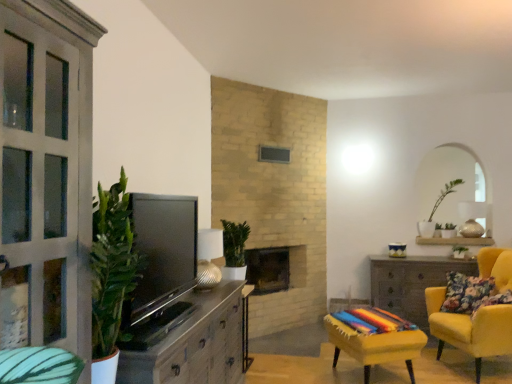
The height and width of the screenshot is (384, 512). Describe the element at coordinates (375, 338) in the screenshot. I see `yellow fabric-covered chair at lower right, which is the 1th chair from left to right` at that location.

The width and height of the screenshot is (512, 384). Find the location of `wooden desk at right`. wooden desk at right is located at coordinates (411, 283).

This screenshot has width=512, height=384. I want to click on green matte plant at upper right, which is the 2th houseplant in left-to-right order, so click(x=436, y=210).

In order to face yellow fabric chair at right, positioned as the 1th chair in right-to-left order, should I rotate leftwards or rightwards?

You should rotate right by 29.006 degrees.

Image resolution: width=512 pixels, height=384 pixels. In order to click on wooden cabinet at left in this screenshot , I will do `click(193, 344)`.

Identify the location of matte black tv at left. Image resolution: width=512 pixels, height=384 pixels. (161, 266).

Considering the relative sizes of floral fabric pillow at right and yellow fabric-covered chair at lower right, acting as the 2th chair starting from the right, in the image provided, is floral fabric pillow at right shorter than yellow fabric-covered chair at lower right, acting as the 2th chair starting from the right,?

Yes, floral fabric pillow at right is shorter than yellow fabric-covered chair at lower right, acting as the 2th chair starting from the right.

You are a GUI agent. You are given a task and a screenshot of the screen. Output one action in this format:
    pyautogui.click(x=<x>, y=<y>)
    Task: Click on the chair that is the 2nd object directly below the floral fabric pillow at right (from a real-world perspective)
    
    Given the screenshot: What is the action you would take?
    pyautogui.click(x=375, y=338)

Can you tell me how much floral fabric pillow at right and yellow fabric-covered chair at lower right, which is the 1th chair from left to right, differ in facing direction?

42.9 degrees.

Is green leafy plant at center-right spatially inside matte black tv at left, or outside of it?

green leafy plant at center-right exists outside the volume of matte black tv at left.

Is green leafy plant at center-right in contact with matte black tv at left?

green leafy plant at center-right is not next to matte black tv at left, and they're not touching.

From the image's perspective, which one is positioned higher, green leafy plant at center-right or matte black tv at left?

matte black tv at left, from the image's perspective.

Can you confirm if yellow fabric-covered chair at lower right, acting as the 2th chair starting from the right, is shorter than metallic ribbed lampshade at center?

Correct, yellow fabric-covered chair at lower right, acting as the 2th chair starting from the right, is not as tall as metallic ribbed lampshade at center.

Which object is positioned more to the right, yellow fabric-covered chair at lower right, acting as the 2th chair starting from the right, or metallic ribbed lampshade at center?

Positioned to the right is yellow fabric-covered chair at lower right, acting as the 2th chair starting from the right.

From a real-world perspective, between yellow fabric-covered chair at lower right, which is the 1th chair from left to right, and metallic ribbed lampshade at center, who is vertically higher?

metallic ribbed lampshade at center is physically above.

Between yellow fabric-covered chair at lower right, which is the 1th chair from left to right, and metallic ribbed lampshade at center, which one has smaller width?

metallic ribbed lampshade at center is thinner.

From a real-world perspective, is green matte plant at center, the first houseplant from the left, positioned over metallic ribbed lampshade at center based on gravity?

No, from a real-world perspective, green matte plant at center, the first houseplant from the left, is not over metallic ribbed lampshade at center

In the image, is green matte plant at center, arranged as the 1th houseplant when viewed from the front, positioned in front of or behind metallic ribbed lampshade at center?

Clearly, green matte plant at center, arranged as the 1th houseplant when viewed from the front, is behind metallic ribbed lampshade at center.

Locate an element on the screen. The width and height of the screenshot is (512, 384). houseplant below the metallic ribbed lampshade at center (from a real-world perspective) is located at coordinates (234, 249).

Can you confirm if green matte plant at center, the first houseplant from the left, is thinner than metallic ribbed lampshade at center?

→ No.

Which object is positioned more to the left, matte black tv at left or metallic ribbed lampshade at center?

matte black tv at left is more to the left.

From the image's perspective, is matte black tv at left above metallic ribbed lampshade at center?

Yes, from the image's perspective, matte black tv at left is above metallic ribbed lampshade at center.

Is matte black tv at left not near metallic ribbed lampshade at center?

matte black tv at left is near metallic ribbed lampshade at center, not far away.

From a real-world perspective, who is located lower, matte black tv at left or metallic ribbed lampshade at center?

metallic ribbed lampshade at center.

Image resolution: width=512 pixels, height=384 pixels. I want to click on pillow on the right of the brick fireplace at center, so click(x=466, y=293).

Looking at their sizes, would you say brick fireplace at center is wider or thinner than floral fabric pillow at right?

In the image, brick fireplace at center appears to be wider than floral fabric pillow at right.

From the image's perspective, is brick fireplace at center above or below floral fabric pillow at right?

Based on their image positions, brick fireplace at center is located above floral fabric pillow at right.

Is brick fireplace at center in front of or behind floral fabric pillow at right in the image?

Visually, brick fireplace at center is located behind floral fabric pillow at right.

Looking at this image, which object is further away from the camera taking this photo, yellow fabric-covered chair at lower right, which is the 1th chair from left to right, or wooden desk at right?

wooden desk at right is further away from the camera.

Considering the positions of objects yellow fabric-covered chair at lower right, which is the 1th chair from left to right, and wooden desk at right in the image provided, who is more to the right, yellow fabric-covered chair at lower right, which is the 1th chair from left to right, or wooden desk at right?

wooden desk at right.

In terms of width, does yellow fabric-covered chair at lower right, acting as the 2th chair starting from the right, look wider or thinner when compared to wooden desk at right?

Clearly, yellow fabric-covered chair at lower right, acting as the 2th chair starting from the right, has more width compared to wooden desk at right.

Based on the photo, is yellow fabric-covered chair at lower right, which is the 1th chair from left to right, bigger than wooden desk at right?

Incorrect, yellow fabric-covered chair at lower right, which is the 1th chair from left to right, is not larger than wooden desk at right.

At what (x,y) coordinates should I click in order to perform the action: click on pillow behind the yellow fabric-covered chair at lower right, which is the 1th chair from left to right. Please return your answer as a coordinate pair (x, y). The image size is (512, 384). Looking at the image, I should click on (466, 293).

Where is `television lying on the left of green leafy plant at center-right`? Image resolution: width=512 pixels, height=384 pixels. television lying on the left of green leafy plant at center-right is located at coordinates (161, 266).

Estimate the real-world distances between objects in this image. Which object is further from yellow fabric-covered chair at lower right, acting as the 2th chair starting from the right, brick fireplace at center or matte black tv at left?

Among the two, matte black tv at left is located further to yellow fabric-covered chair at lower right, acting as the 2th chair starting from the right.

Which object lies nearer to the anchor point yellow fabric-covered chair at lower right, acting as the 2th chair starting from the right, brick fireplace at center or floral fabric pillow at right?

Among the two, floral fabric pillow at right is located nearer to yellow fabric-covered chair at lower right, acting as the 2th chair starting from the right.

Considering their positions, is metallic ribbed lampshade at center positioned closer to green matte plant at upper right, the 1th houseplant in the back-to-front sequence, than yellow fabric chair at right, positioned as the 1th chair in right-to-left order?

yellow fabric chair at right, positioned as the 1th chair in right-to-left order, is closer to green matte plant at upper right, the 1th houseplant in the back-to-front sequence.

Which object lies further to the anchor point wooden cabinet at left, yellow fabric-covered chair at lower right, which is the 1th chair from left to right, or metallic ribbed lampshade at center?

Based on the image, yellow fabric-covered chair at lower right, which is the 1th chair from left to right, appears to be further to wooden cabinet at left.

Estimate the real-world distances between objects in this image. Which object is further from matte black tv at left, yellow fabric-covered chair at lower right, which is the 1th chair from left to right, or green matte plant at center, the first houseplant from the left?

yellow fabric-covered chair at lower right, which is the 1th chair from left to right, is positioned further to the anchor matte black tv at left.

Looking at this image, based on their spatial positions, is green matte plant at upper right, which is the 2th houseplant in left-to-right order, or matte black tv at left closer to yellow fabric-covered chair at lower right, acting as the 2th chair starting from the right?

matte black tv at left.

Considering their positions, is metallic ribbed lampshade at center positioned further to wooden cabinet at left than green matte plant at center, the second houseplant from the right?

green matte plant at center, the second houseplant from the right, is positioned further to the anchor wooden cabinet at left.

Looking at this image, based on their spatial positions, is matte black tv at left or green leafy plant at center-right further from yellow fabric chair at right, the second chair viewed from the left?

Based on the image, matte black tv at left appears to be further to yellow fabric chair at right, the second chair viewed from the left.

I want to click on plant positioned between floral fabric pillow at right and green matte plant at upper right, the 1th houseplant in the back-to-front sequence, from near to far, so coord(460,249).

Find the location of a particular element. Image resolution: width=512 pixels, height=384 pixels. television located between wooden cabinet at left and green matte plant at upper right, placed as the 2th houseplant when sorted from front to back, in the depth direction is located at coordinates (161, 266).

The width and height of the screenshot is (512, 384). Find the location of `chair between green matte plant at center, the second houseplant from the right, and yellow fabric chair at right, the second chair viewed from the left`. chair between green matte plant at center, the second houseplant from the right, and yellow fabric chair at right, the second chair viewed from the left is located at coordinates (375, 338).

The image size is (512, 384). Find the location of `pillow situated between metallic ribbed lampshade at center and green matte plant at upper right, which is the 2th houseplant in left-to-right order, from left to right`. pillow situated between metallic ribbed lampshade at center and green matte plant at upper right, which is the 2th houseplant in left-to-right order, from left to right is located at coordinates (466, 293).